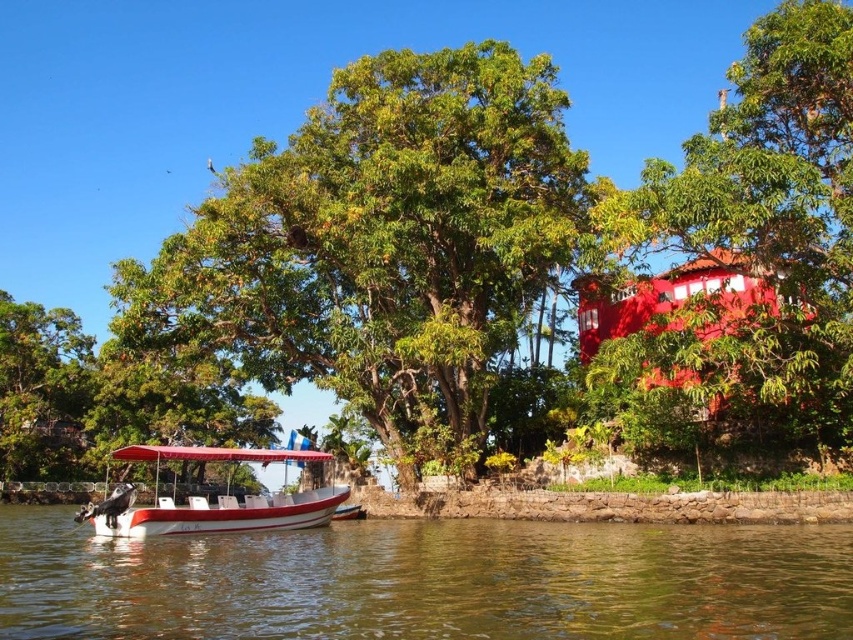
In the scene shown: You are planning to take a photo of the white glossy boat at lower left and the green leafy tree at upper right. From your current position, which object is positioned to the right side of the other?

The green leafy tree at upper right is positioned to the right of the white glossy boat at lower left.

You are standing at the point marked by the coordinates point (x=426, y=580). Looking around, you see the greenish brown water at lower center. Which direction should you walk to reach the nearest solid ground?

The point (x=426, y=580) corresponds to the greenish brown water at lower center. To reach solid ground, you should walk in the direction away from the water towards the shore. Since the water is at the lower center, moving upwards or towards the edges would lead to solid ground.